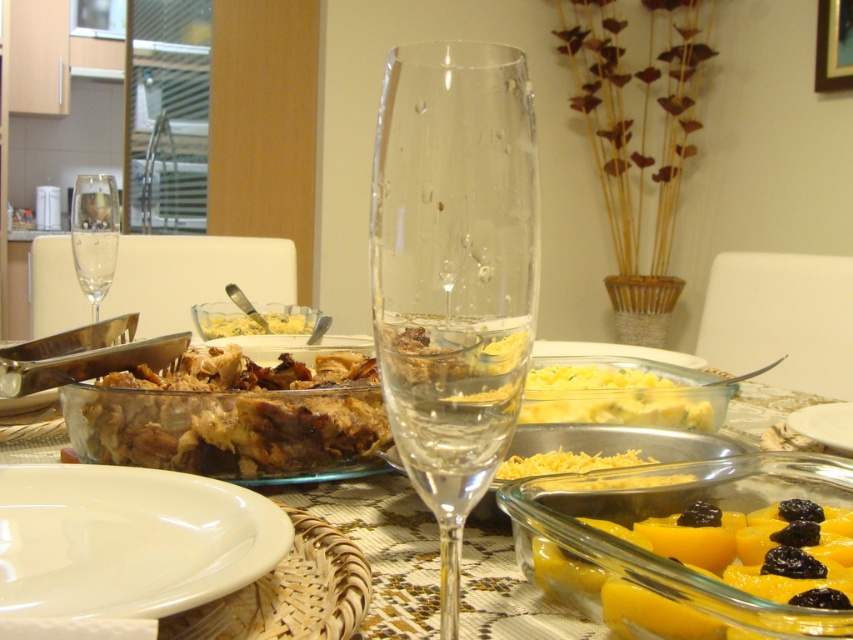
You are a guest at the table and want to place your napkin on the white ceramic plate at lower left. Given that the table is 1.2 meters wide, can you reach the plate from your current position at point [128,540]?

The white ceramic plate at lower left is located at point [128,540]. Since you are already at that position, you can easily reach the plate to place your napkin there.

You are a server who needs to place a 8 inch long utensil between the white ceramic plate at lower left and the clear glass wine glass at center. Is there enough space?

The distance between the white ceramic plate at lower left and the clear glass wine glass at center is 7.50 inches, which is less than the 8 inch utensil. Therefore, there is not enough space to place the utensil between them.

You are a guest at the table and want to grab a drink. The transparent glass at center and the yellow gelatinous cubes at center are both in your way. Which one do you need to move first to reach the drink?

The yellow gelatinous cubes at center must be moved first because the transparent glass at center is taller than them, meaning the glass is closer to you and blocking the cubes. Since you need to reach the drink in the glass, you don wait to move the cubes first.